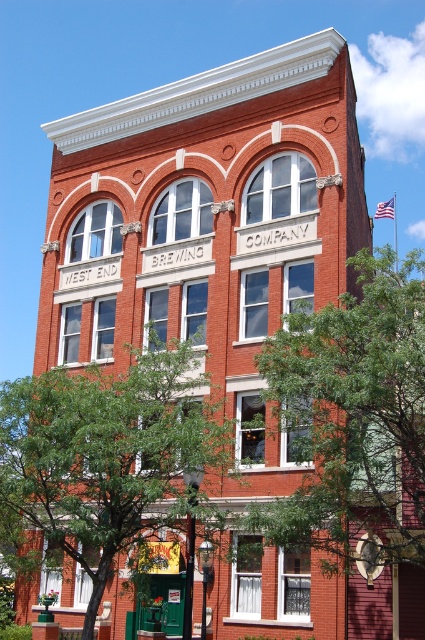
Question: Which of the following is the closest to the observer?

Choices:
 (A) green leafy tree at right
 (B) green leafy tree at center

Answer: (A)

Question: Can you confirm if green leafy tree at right is positioned to the left of green leafy tree at center?

Choices:
 (A) yes
 (B) no

Answer: (B)

Question: Observing the image, what is the correct spatial positioning of green leafy tree at right in reference to green leafy tree at center?

Choices:
 (A) left
 (B) right

Answer: (B)

Question: Among these objects, which one is farthest from the camera?

Choices:
 (A) green leafy tree at right
 (B) green leafy tree at center

Answer: (B)

Question: Can you confirm if green leafy tree at right is smaller than green leafy tree at center?

Choices:
 (A) no
 (B) yes

Answer: (B)

Question: Among these objects, which one is nearest to the camera?

Choices:
 (A) green leafy tree at right
 (B) green leafy tree at center

Answer: (A)